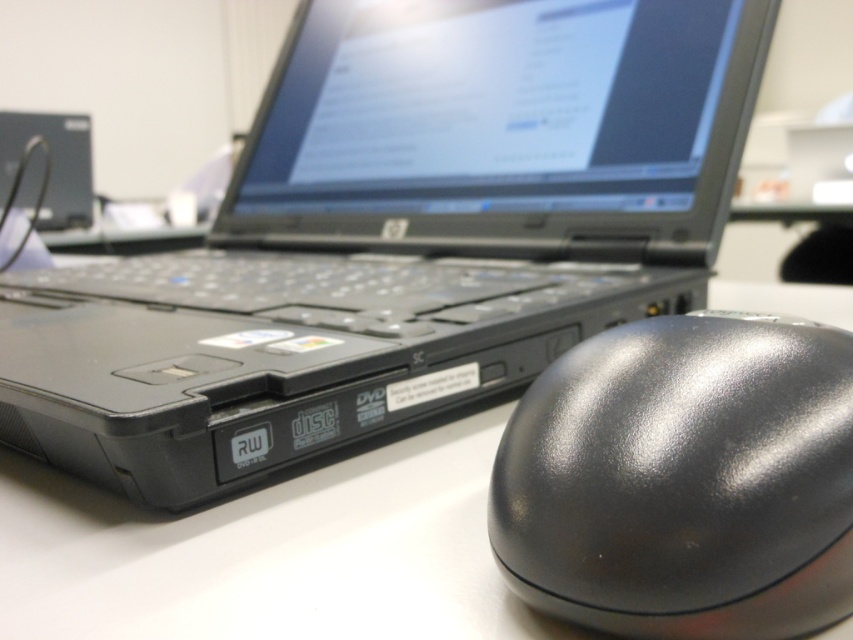
Is glossy black mouse at lower right further to the viewer compared to white matte table at center?

No, it is not.

Can you confirm if glossy black mouse at lower right is positioned to the right of white matte table at center?

Indeed, glossy black mouse at lower right is positioned on the right side of white matte table at center.

Does point (741, 392) come in front of point (183, 625)?

Yes.

You are a GUI agent. You are given a task and a screenshot of the screen. Output one action in this format:
    pyautogui.click(x=<x>, y=<y>)
    Task: Click on the glossy black mouse at lower right
    The height and width of the screenshot is (640, 853).
    Given the screenshot: What is the action you would take?
    pyautogui.click(x=683, y=480)

Consider the image. Which of these two, black matte laptop at center or glossy black mouse at lower right, stands shorter?

glossy black mouse at lower right is shorter.

Identify the location of black matte laptop at center. The height and width of the screenshot is (640, 853). (397, 236).

Does black matte laptop at center appear over white matte table at center?

Yes, black matte laptop at center is above white matte table at center.

Is black matte laptop at center positioned in front of white matte table at center?

That is False.

Is point (535, 356) farther from camera compared to point (457, 518)?

Yes.

The width and height of the screenshot is (853, 640). Identify the location of black matte laptop at center. (397, 236).